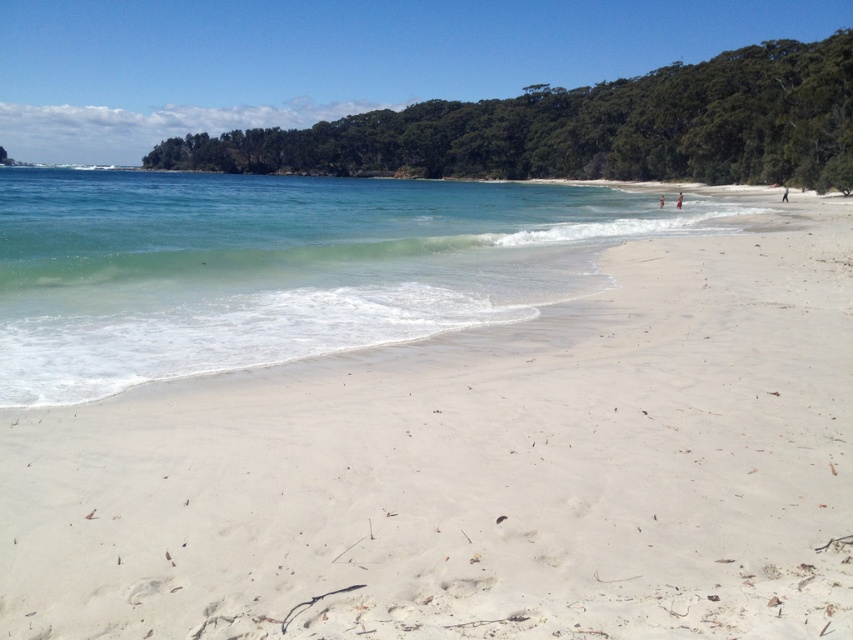
You are planning to set up a small tent on the white sandy beach at center and a picnic blanket on the clear water at lower left. Which location has more space available for your setup?

The clear water at lower left has more space available because it occupies more area than the white sandy beach at center.

You are standing on the white sandy beach at center and want to reach the clear water at lower left. Which direction should you move to get there?

To reach the clear water at lower left from the white sandy beach at center, you should move downward since the white sandy beach at center is located below the clear water at lower left.